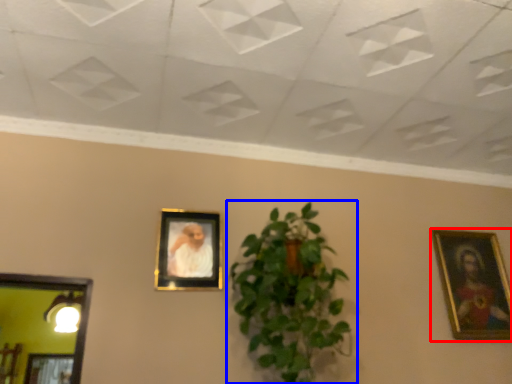
Question: Which point is closer to the camera, picture frame (highlighted by a red box) or houseplant (highlighted by a blue box)?

Choices:
 (A) picture frame
 (B) houseplant

Answer: (B)